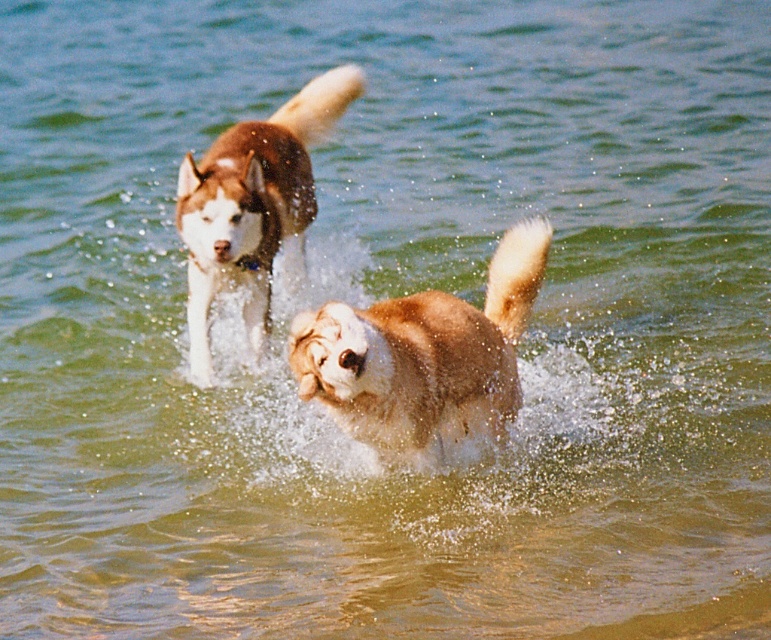
Is fuzzy brown dog at center bigger than brown fur dog at center?

No, fuzzy brown dog at center is not bigger than brown fur dog at center.

Looking at this image, does fuzzy brown dog at center have a greater width compared to brown fur dog at center?

Yes, fuzzy brown dog at center is wider than brown fur dog at center.

Does point (401, 330) come in front of point (194, 362)?

That is True.

I want to click on fuzzy brown dog at center, so click(423, 355).